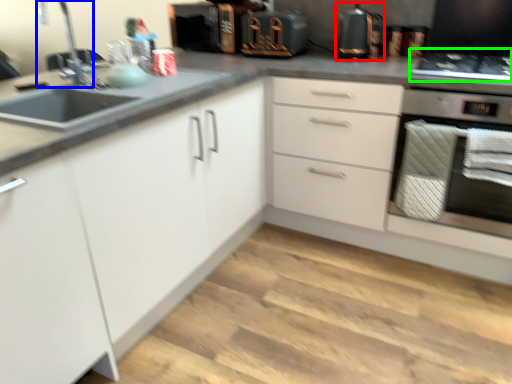
Question: Which object is positioned farthest from kitchen appliance (highlighted by a red box)? Select from faucet (highlighted by a blue box) and gas stove (highlighted by a green box).

Choices:
 (A) faucet
 (B) gas stove

Answer: (A)